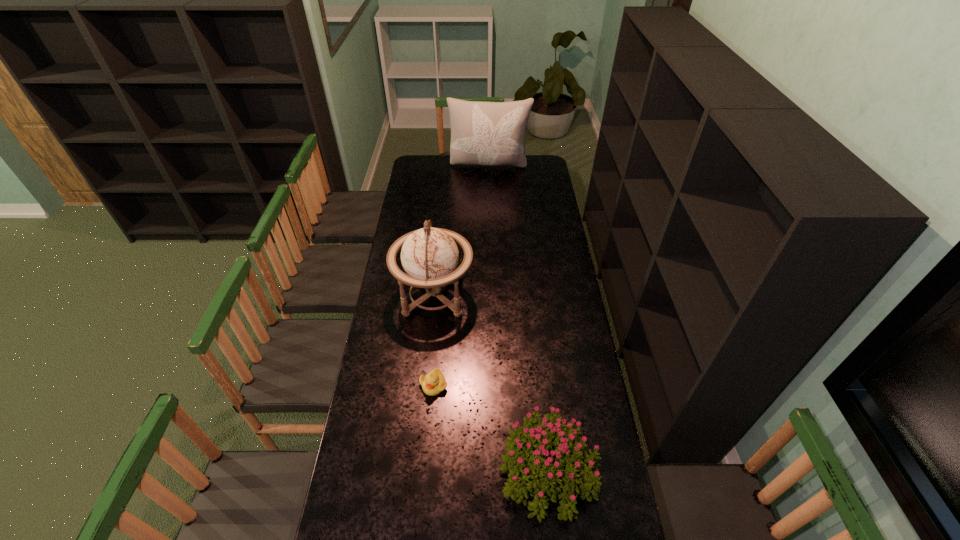
Locate an element on the screen. cushion is located at coordinates (482, 133).

Where is `globe`? globe is located at coordinates click(x=430, y=257).

At what (x,y) coordinates should I click in order to perform the action: click on the nearest object. Please return your answer as a coordinate pair (x, y). The image size is (960, 540). Looking at the image, I should click on (526, 443).

Where is `the third tallest object`? This screenshot has width=960, height=540. the third tallest object is located at coordinates (526, 443).

Locate an element on the screen. the second nearest object is located at coordinates (433, 383).

What are the coordinates of `duckling` in the screenshot? It's located at 433,383.

Identify the location of vacant space located 0.160m on the front side of the farthest object. The image size is (960, 540). (490, 192).

At what (x,y) coordinates should I click in order to perform the action: click on vacant space located 0.280m at the front of the globe showing Africa. Please return your answer as a coordinate pair (x, y). The width and height of the screenshot is (960, 540). Looking at the image, I should click on (537, 296).

At what (x,y) coordinates should I click in order to perform the action: click on vacant space located 0.330m on the left of the nearest object. Please return your answer as a coordinate pair (x, y). Looking at the image, I should click on (396, 471).

This screenshot has height=540, width=960. I want to click on vacant space situated 0.290m at the face of the shortest object, so click(425, 479).